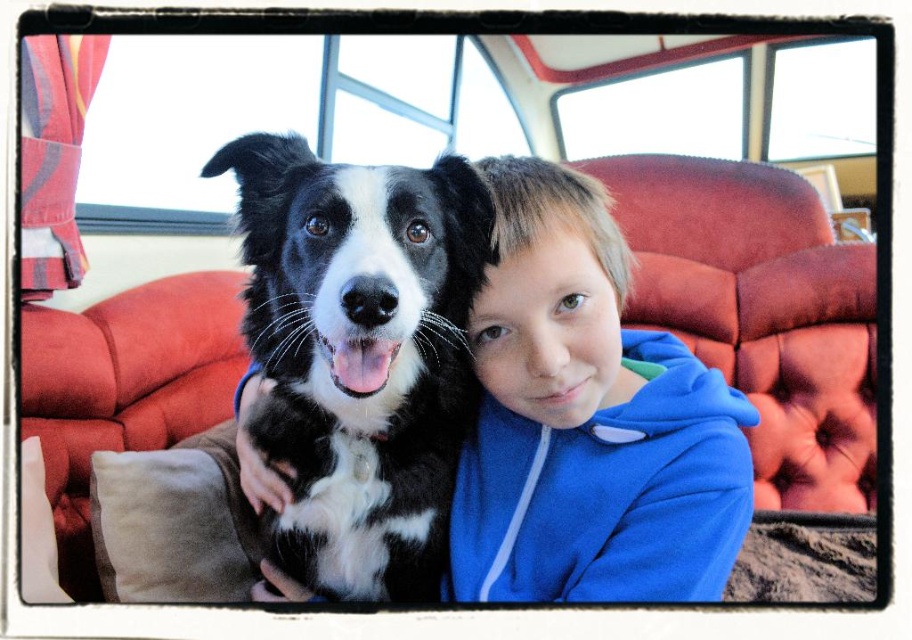
You are a photographer trying to capture a candid shot of the two subjects in the vehicle. Since you want to ensure both the blue fleece jacket at center and the black and white fur at center are clearly visible in the frame, which one should you position closer to the camera to avoid any overlap?

The blue fleece jacket at center is on the right side of the black and white fur at center. To avoid overlap and ensure both are visible, position the black and white fur at center closer to the camera so that the blue fleece jacket at center does not block its view.

You are standing 1.04 meters away from the point at coordinates point (477, 554). If you want to reach the young boy wearing a blue hoodie and the black and white dog sitting together, can you comfortably extend your hand to touch them without moving your feet?

The point at coordinates point (477, 554) is 1.04 meters away from you. Since the young boy and the black and white dog are at that point, you can comfortably extend your hand to touch them without moving your feet as the distance is within arm reach.